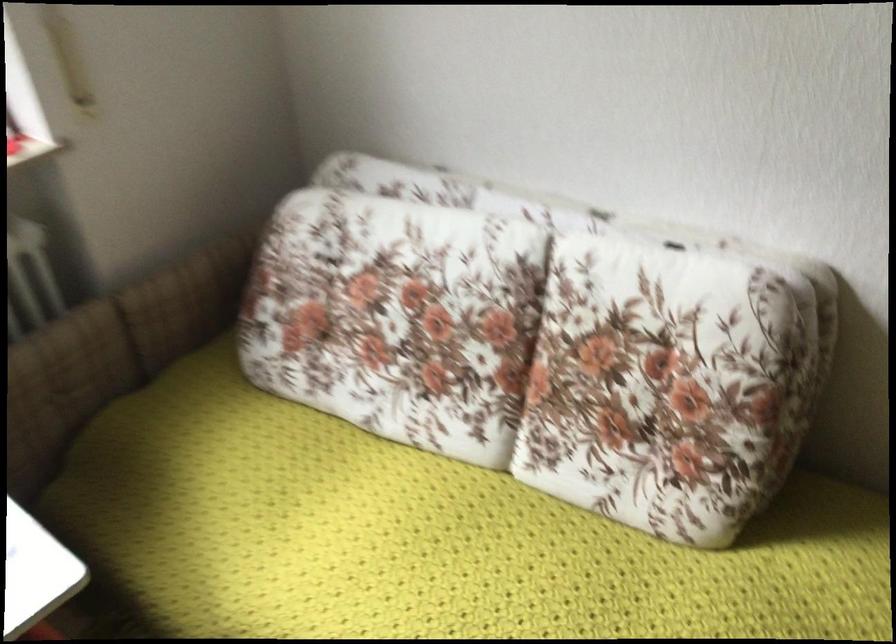
This screenshot has height=644, width=896. Describe the element at coordinates (63, 384) in the screenshot. I see `the sofa armrest` at that location.